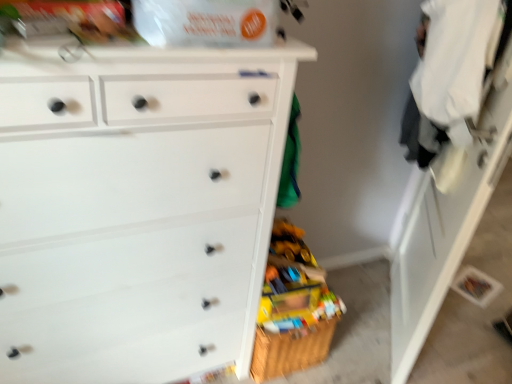
You are a GUI agent. You are given a task and a screenshot of the screen. Output one action in this format:
    pyautogui.click(x=<x>, y=<y>)
    Task: Click on the white glossy cabinet at right
    The height and width of the screenshot is (384, 512).
    Given the screenshot: What is the action you would take?
    pyautogui.click(x=448, y=216)

Describe the element at coordinates (448, 216) in the screenshot. I see `white glossy cabinet at right` at that location.

This screenshot has height=384, width=512. Describe the element at coordinates (137, 208) in the screenshot. I see `white matte chest of drawers at left` at that location.

Measure the distance between point (42,85) and camera.

Point (42,85) and camera are 34.92 inches apart from each other.

Find the location of `white matte chest of drawers at left`. white matte chest of drawers at left is located at coordinates (137, 208).

Find the location of `white glossy cabinet at right`. white glossy cabinet at right is located at coordinates (448, 216).

Can you confirm if white glossy cabinet at right is positioned to the left of white matte chest of drawers at left?

In fact, white glossy cabinet at right is to the right of white matte chest of drawers at left.

Based on the photo, does white glossy cabinet at right come in front of white matte chest of drawers at left?

That is False.

Is point (481, 200) in front of point (47, 267)?

No.

From the image's perspective, which one is positioned lower, white glossy cabinet at right or white matte chest of drawers at left?

white matte chest of drawers at left.

From a real-world perspective, is white glossy cabinet at right on top of white matte chest of drawers at left?

Yes.

Looking at this image, can you confirm if white glossy cabinet at right is wider than white matte chest of drawers at left?

No, white glossy cabinet at right is not wider than white matte chest of drawers at left.

Who is shorter, white glossy cabinet at right or white matte chest of drawers at left?

With less height is white matte chest of drawers at left.

Which of these two, white glossy cabinet at right or white matte chest of drawers at left, is smaller?

white glossy cabinet at right.

Based on the photo, is white glossy cabinet at right not inside white matte chest of drawers at left?

white glossy cabinet at right is positioned outside white matte chest of drawers at left.

Is white glossy cabinet at right with white matte chest of drawers at left?

white glossy cabinet at right is not next to white matte chest of drawers at left, and they're not touching.

Is white glossy cabinet at right looking in the opposite direction of white matte chest of drawers at left?

No, white glossy cabinet at right is not facing away from white matte chest of drawers at left.

What's the angular difference between white glossy cabinet at right and white matte chest of drawers at left's facing directions?

There is a 127-degree angle between the facing directions of white glossy cabinet at right and white matte chest of drawers at left.

The image size is (512, 384). What are the coordinates of `chest of drawers that appears on the left of white glossy cabinet at right` in the screenshot? It's located at tap(137, 208).

Considering the positions of objects white matte chest of drawers at left and white glossy cabinet at right in the image provided, who is more to the right, white matte chest of drawers at left or white glossy cabinet at right?

white glossy cabinet at right.

Is the depth of white matte chest of drawers at left greater than that of white glossy cabinet at right?

No.

Considering the positions of point (97, 59) and point (399, 363), is point (97, 59) closer or farther from the camera than point (399, 363)?

Point (97, 59) is positioned closer to the camera compared to point (399, 363).

From the image's perspective, which is below, white matte chest of drawers at left or white glossy cabinet at right?

From the image's view, white matte chest of drawers at left is below.

From a real-world perspective, which object rests below the other?

white matte chest of drawers at left is physically lower.

Is white matte chest of drawers at left wider than white glossy cabinet at right?

Yes, white matte chest of drawers at left is wider than white glossy cabinet at right.

Considering the relative sizes of white matte chest of drawers at left and white glossy cabinet at right in the image provided, is white matte chest of drawers at left taller than white glossy cabinet at right?

No.

Considering the sizes of objects white matte chest of drawers at left and white glossy cabinet at right in the image provided, who is bigger, white matte chest of drawers at left or white glossy cabinet at right?

→ Bigger between the two is white matte chest of drawers at left.

Is white matte chest of drawers at left spatially inside white glossy cabinet at right, or outside of it?

white matte chest of drawers at left lies outside white glossy cabinet at right.

Is white matte chest of drawers at left beside white glossy cabinet at right?

white matte chest of drawers at left and white glossy cabinet at right are clearly separated.

Is white matte chest of drawers at left facing towards white glossy cabinet at right?

No, white matte chest of drawers at left is not oriented towards white glossy cabinet at right.

How many degrees apart are the facing directions of white matte chest of drawers at left and white glossy cabinet at right?

They differ by 127 degrees in their facing directions.

How distant is white matte chest of drawers at left from white glossy cabinet at right?

white matte chest of drawers at left and white glossy cabinet at right are 89.37 centimeters apart from each other.

Find the location of a particular element. The height and width of the screenshot is (384, 512). dresser above the white matte chest of drawers at left (from a real-world perspective) is located at coordinates (448, 216).

Identify the location of dresser above the white matte chest of drawers at left (from the image's perspective). This screenshot has width=512, height=384. (448, 216).

Find the location of a particular element. This screenshot has width=512, height=384. chest of drawers below the white glossy cabinet at right (from the image's perspective) is located at coordinates (137, 208).